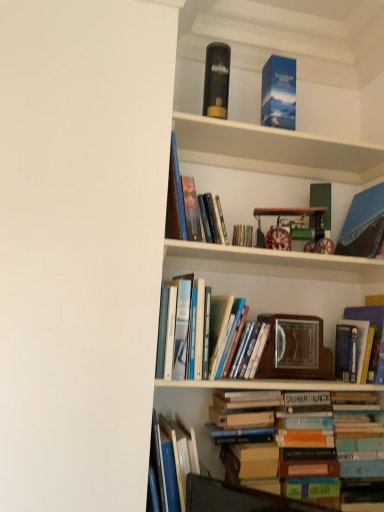
Question: Is hardcover book at center, positioned as the sixth book in top-to-bottom order, wider or thinner than hardcover book at center, arranged as the 2th book when viewed from the top?

Choices:
 (A) wide
 (B) thin

Answer: (A)

Question: In the image, is hardcover book at center, which appears as the third book when ordered from the bottom, positioned in front of or behind hardcover book at center, arranged as the 2th book when viewed from the top?

Choices:
 (A) front
 (B) behind

Answer: (A)

Question: Which is farther from the wooden picture frame at center?

Choices:
 (A) hardcover books at center, which is counted as the 2th book, starting from the bottom
 (B) black matte book at upper center
 (C) blue cardboard box at upper center
 (D) blue canvas painting at upper right, the third book positioned from the top
 (E) blue matte book at upper center, positioned as the eighth book in bottom-to-top order

Answer: (B)

Question: Considering the real-world distances, which object is farthest from the hardcover book at center, the 5th book in the bottom-to-top sequence?

Choices:
 (A) wooden picture frame at center
 (B) black matte book at upper center
 (C) hardcover books at center, placed as the fifth book when sorted from top to bottom
 (D) blue cardboard box at upper center
 (E) blue matte book at upper center, positioned as the eighth book in bottom-to-top order

Answer: (B)